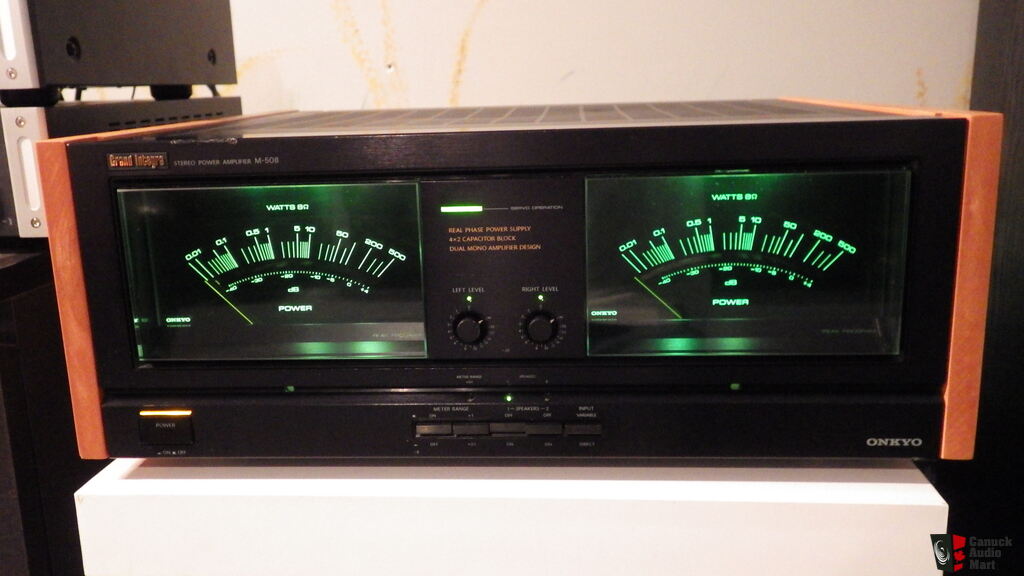
You are a GUI agent. You are given a task and a screenshot of the screen. Output one action in this format:
    pyautogui.click(x=<x>, y=<y>)
    Task: Click on the front of white cabinet
    This screenshot has height=576, width=1024.
    Given the screenshot: What is the action you would take?
    pyautogui.click(x=534, y=518)